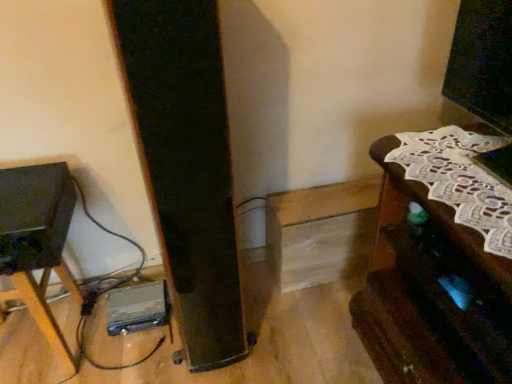
Question: Are brown wooden table at right, which is the second furniture from left to right, and matte black speaker at left located far from each other?

Choices:
 (A) no
 (B) yes

Answer: (A)

Question: Is brown wooden table at right, the first furniture positioned from the right, smaller than matte black speaker at left?

Choices:
 (A) no
 (B) yes

Answer: (A)

Question: Is brown wooden table at right, which is the second furniture from left to right, shorter than matte black speaker at left?

Choices:
 (A) yes
 (B) no

Answer: (B)

Question: Are brown wooden table at right, the first furniture positioned from the right, and matte black speaker at left making contact?

Choices:
 (A) no
 (B) yes

Answer: (A)

Question: From a real-world perspective, is brown wooden table at right, which is the second furniture from left to right, on top of matte black speaker at left?

Choices:
 (A) no
 (B) yes

Answer: (A)

Question: From the image's perspective, is brown wooden table at right, which is the second furniture from left to right, located above or below matte black speaker at left?

Choices:
 (A) below
 (B) above

Answer: (A)

Question: Is point (395, 286) positioned closer to the camera than point (46, 246)?

Choices:
 (A) closer
 (B) farther

Answer: (B)

Question: In the image, is brown wooden table at right, which is the second furniture from left to right, positioned in front of or behind matte black speaker at left?

Choices:
 (A) front
 (B) behind

Answer: (A)

Question: Considering the relative positions of brown wooden table at right, which is the second furniture from left to right, and matte black speaker at left in the image provided, is brown wooden table at right, which is the second furniture from left to right, to the left or to the right of matte black speaker at left?

Choices:
 (A) right
 (B) left

Answer: (A)

Question: In terms of size, does matte black speaker at left appear bigger or smaller than brown wooden table at right, which is the second furniture from left to right?

Choices:
 (A) big
 (B) small

Answer: (B)

Question: In terms of width, does matte black speaker at left look wider or thinner when compared to brown wooden table at right, the first furniture positioned from the right?

Choices:
 (A) thin
 (B) wide

Answer: (A)

Question: From a real-world perspective, is matte black speaker at left positioned above or below brown wooden table at right, which is the second furniture from left to right?

Choices:
 (A) below
 (B) above

Answer: (B)

Question: Considering their positions, is matte black speaker at left located in front of or behind brown wooden table at right, which is the second furniture from left to right?

Choices:
 (A) front
 (B) behind

Answer: (B)

Question: Visually, is metallic silver tripod at lower left, the 2th furniture viewed from the right, positioned to the left or to the right of matte black speaker at left?

Choices:
 (A) right
 (B) left

Answer: (B)

Question: In terms of height, does metallic silver tripod at lower left, the 2th furniture viewed from the right, look taller or shorter compared to matte black speaker at left?

Choices:
 (A) short
 (B) tall

Answer: (B)